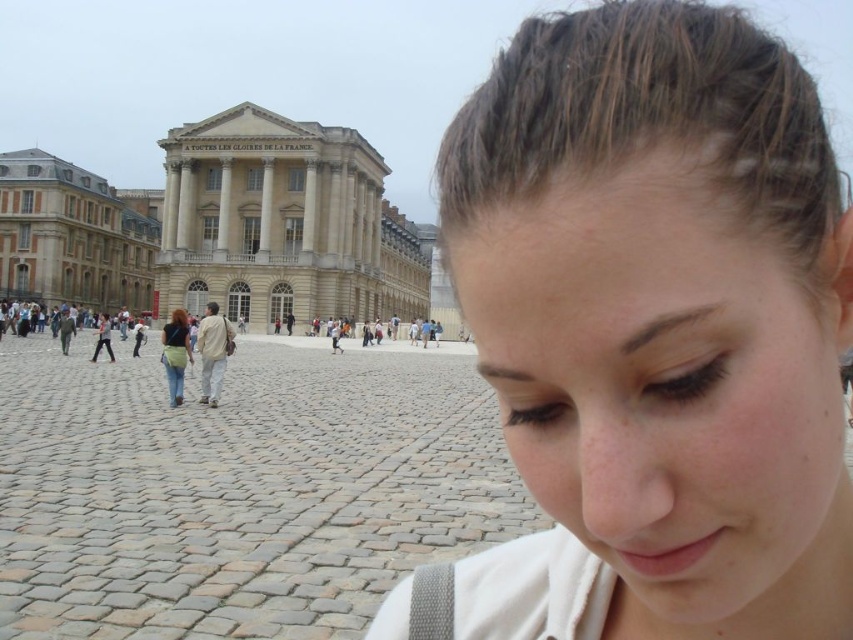
Question: Which object appears closest to the camera in this image?

Choices:
 (A) denim jacket at center
 (B) cobblestone plaza at center
 (C) smooth brown hair at center
 (D) white stone building at center

Answer: (C)

Question: Is white stone building at center positioned in front of beige stone building at center?

Choices:
 (A) yes
 (B) no

Answer: (A)

Question: Among these objects, which one is farthest from the camera?

Choices:
 (A) beige stone building at center
 (B) white stone building at center

Answer: (A)

Question: Does white stone building at center appear over denim jacket at center?

Choices:
 (A) no
 (B) yes

Answer: (B)

Question: Among these objects, which one is farthest from the camera?

Choices:
 (A) matte gray pants at center
 (B) cobblestone plaza at center
 (C) smooth brown hair at center
 (D) white stone building at center

Answer: (D)

Question: Does smooth brown hair at center appear on the right side of matte gray pants at center?

Choices:
 (A) yes
 (B) no

Answer: (A)